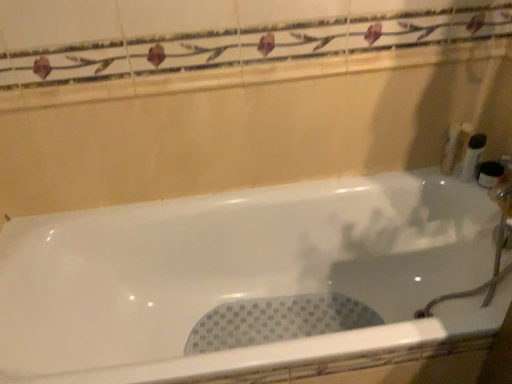
This screenshot has height=384, width=512. Identify the location of vacant position to the left of white plastic container at right, the 2th toiletry in the left-to-right sequence. click(421, 177).